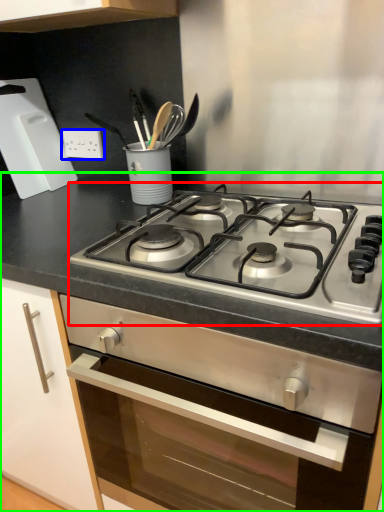
Question: Which object is the closest to the gas stove (highlighted by a red box)? Choose among these: electric outlet (highlighted by a blue box) or countertop (highlighted by a green box).

Choices:
 (A) electric outlet
 (B) countertop

Answer: (B)